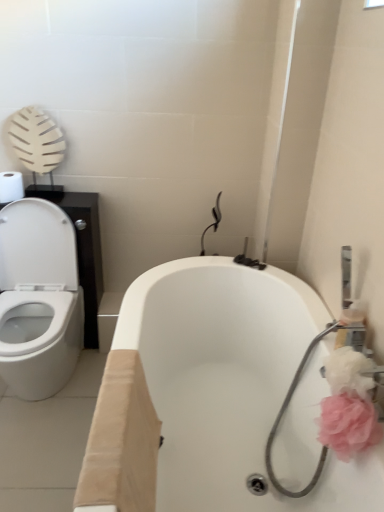
Question: Are pink fluffy flower at right, which ranks as the 1th flower in top-to-bottom order, and white matte toilet paper at upper left located far from each other?

Choices:
 (A) yes
 (B) no

Answer: (A)

Question: Considering the relative positions of pink fluffy flower at right, acting as the second flower starting from the bottom, and white matte toilet paper at upper left in the image provided, is pink fluffy flower at right, acting as the second flower starting from the bottom, to the left of white matte toilet paper at upper left from the viewer's perspective?

Choices:
 (A) yes
 (B) no

Answer: (B)

Question: Would you say pink fluffy flower at right, acting as the second flower starting from the bottom, contains white matte toilet paper at upper left?

Choices:
 (A) no
 (B) yes

Answer: (A)

Question: Is pink fluffy flower at right, which ranks as the 1th flower in top-to-bottom order, placed right next to white matte toilet paper at upper left?

Choices:
 (A) no
 (B) yes

Answer: (A)

Question: From the image's perspective, is pink fluffy flower at right, which ranks as the 1th flower in top-to-bottom order, beneath white matte toilet paper at upper left?

Choices:
 (A) yes
 (B) no

Answer: (A)

Question: In terms of width, does pink fluffy flower at right, acting as the second flower starting from the bottom, look wider or thinner when compared to white matte toilet paper at upper left?

Choices:
 (A) thin
 (B) wide

Answer: (A)

Question: Does point (342, 362) appear closer or farther from the camera than point (13, 172)?

Choices:
 (A) closer
 (B) farther

Answer: (A)

Question: Would you say pink fluffy flower at right, which ranks as the 1th flower in top-to-bottom order, is to the left or to the right of white matte toilet paper at upper left in the picture?

Choices:
 (A) left
 (B) right

Answer: (B)

Question: Relative to white matte toilet paper at upper left, is pink fluffy flower at right, acting as the second flower starting from the bottom, in front or behind?

Choices:
 (A) front
 (B) behind

Answer: (A)

Question: Is pink fluffy flower at right, which ranks as the 1th flower in top-to-bottom order, bigger or smaller than pink fabric flower at right, positioned as the 2th flower in top-to-bottom order?

Choices:
 (A) big
 (B) small

Answer: (B)

Question: Is pink fluffy flower at right, acting as the second flower starting from the bottom, in front of or behind pink fabric flower at right, which appears as the first flower when ordered from the bottom, in the image?

Choices:
 (A) behind
 (B) front

Answer: (A)

Question: Based on their positions, is pink fluffy flower at right, acting as the second flower starting from the bottom, located to the left or right of pink fabric flower at right, which appears as the first flower when ordered from the bottom?

Choices:
 (A) right
 (B) left

Answer: (A)

Question: From their relative heights in the image, would you say pink fluffy flower at right, acting as the second flower starting from the bottom, is taller or shorter than pink fabric flower at right, which appears as the first flower when ordered from the bottom?

Choices:
 (A) tall
 (B) short

Answer: (B)

Question: From their relative heights in the image, would you say pink fabric flower at right, which appears as the first flower when ordered from the bottom, is taller or shorter than white glossy bathtub at center?

Choices:
 (A) tall
 (B) short

Answer: (B)

Question: Is point (339, 434) closer or farther from the camera than point (281, 376)?

Choices:
 (A) farther
 (B) closer

Answer: (B)